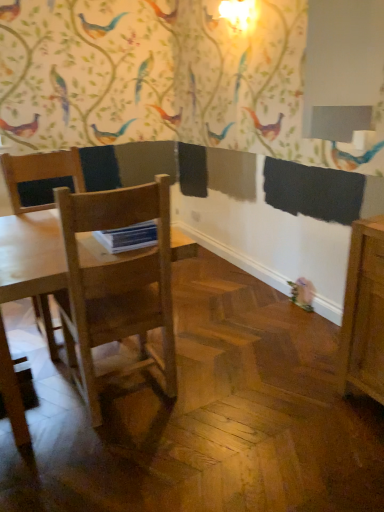
The width and height of the screenshot is (384, 512). I want to click on light wood table at center, so click(31, 256).

The width and height of the screenshot is (384, 512). What do you see at coordinates (31, 256) in the screenshot?
I see `light wood table at center` at bounding box center [31, 256].

The height and width of the screenshot is (512, 384). What do you see at coordinates (41, 177) in the screenshot?
I see `light brown wood chair at left` at bounding box center [41, 177].

At what (x,y) coordinates should I click in order to perform the action: click on light brown wood chair at left. Please return your answer as a coordinate pair (x, y). The width and height of the screenshot is (384, 512). Looking at the image, I should click on (41, 177).

In order to face light brown wood chair at left, should I rotate leftwards or rightwards?

It's best to rotate left around 16.704 degrees.

In order to click on light wood table at center in this screenshot , I will do `click(31, 256)`.

Is light brown wood chair at left to the left or to the right of light wood table at center in the image?

Based on their positions, light brown wood chair at left is located to the left of light wood table at center.

Between light brown wood chair at left and light wood table at center, which one is positioned in front?

Positioned in front is light wood table at center.

Considering the positions of point (55, 342) and point (98, 274), is point (55, 342) closer or farther from the camera than point (98, 274)?

Point (55, 342) is farther from the camera than point (98, 274).

From the image's perspective, is light brown wood chair at left on top of light wood table at center?

Correct, light brown wood chair at left appears higher than light wood table at center in the image.

From a real-world perspective, is light brown wood chair at left beneath light wood table at center?

Yes.

Which object is thinner, light brown wood chair at left or light wood table at center?

With smaller width is light wood table at center.

Can you confirm if light brown wood chair at left is taller than light wood table at center?

No.

Based on their sizes in the image, would you say light brown wood chair at left is bigger or smaller than light wood table at center?

In the image, light brown wood chair at left appears to be larger than light wood table at center.

Would you say light brown wood chair at left is inside or outside light wood table at center?

light brown wood chair at left exists outside the volume of light wood table at center.

Is light brown wood chair at left not close to light wood table at center?

No.

Is light wood table at center at the back of light brown wood chair at left?

light brown wood chair at left is not turned away from light wood table at center.

Based on the photo, can you tell me how much light brown wood chair at left and light wood table at center differ in facing direction?

The angle between the facing direction of light brown wood chair at left and the facing direction of light wood table at center is 174 degrees.

In the image, there is a light brown wood chair at left. Identify the location of table below it (from the image's perspective). pyautogui.click(x=31, y=256).

Based on their positions, is light wood table at center located to the left or right of light brown wood chair at left?

In the image, light wood table at center appears on the right side of light brown wood chair at left.

Which is behind, light wood table at center or light brown wood chair at left?

light brown wood chair at left.

Is point (64, 263) in front of point (56, 357)?

Yes, point (64, 263) is in front of point (56, 357).

From the picture: From the image's perspective, is light wood table at center on top of light brown wood chair at left?

Incorrect, from the image's perspective, light wood table at center is lower than light brown wood chair at left.

From a real-world perspective, between light wood table at center and light brown wood chair at left, who is vertically higher?

From a 3D spatial view, light wood table at center is above.

Can you confirm if light wood table at center is wider than light brown wood chair at left?

No, light wood table at center is not wider than light brown wood chair at left.

Does light wood table at center have a lesser height compared to light brown wood chair at left?

In fact, light wood table at center may be taller than light brown wood chair at left.

Considering the relative sizes of light wood table at center and light brown wood chair at left in the image provided, is light wood table at center smaller than light brown wood chair at left?

Yes.

Choose the correct answer: Is light wood table at center inside light brown wood chair at left or outside it?

light wood table at center is outside light brown wood chair at left.

Is light wood table at center positioned far away from light brown wood chair at left?

light wood table at center is actually quite close to light brown wood chair at left.

Is light wood table at center oriented towards light brown wood chair at left?

Yes, light wood table at center is aimed at light brown wood chair at left.

Find the location of a particular element. The image size is (384, 512). chair behind the light wood table at center is located at coordinates (41, 177).

Identify the location of table above the light brown wood chair at left (from a real-world perspective). (31, 256).

Where is `chair above the light wood table at center (from the image's perspective)`? chair above the light wood table at center (from the image's perspective) is located at coordinates (41, 177).